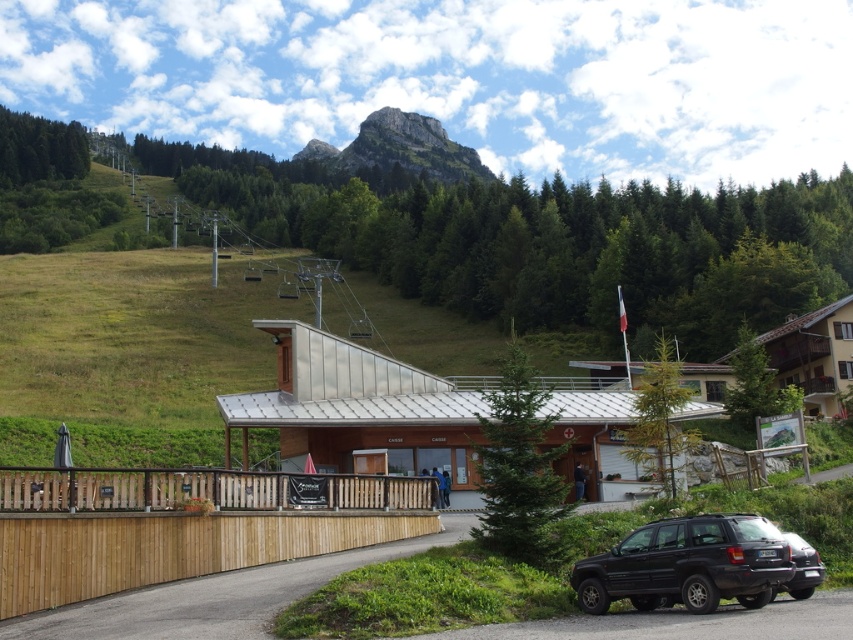
Between wooden fence at lower center and black matte suv at lower right, which one has more height?

wooden fence at lower center

How far apart are wooden fence at lower center and black matte suv at lower right?

wooden fence at lower center and black matte suv at lower right are 15.15 meters apart from each other.

The height and width of the screenshot is (640, 853). What do you see at coordinates (181, 525) in the screenshot?
I see `wooden fence at lower center` at bounding box center [181, 525].

Image resolution: width=853 pixels, height=640 pixels. What are the coordinates of `wooden fence at lower center` in the screenshot? It's located at (181, 525).

Between brown wooden fence at lower center and green rocky mountain at upper center, which one has less height?

brown wooden fence at lower center

Is brown wooden fence at lower center smaller than green rocky mountain at upper center?

Indeed, brown wooden fence at lower center has a smaller size compared to green rocky mountain at upper center.

The height and width of the screenshot is (640, 853). What do you see at coordinates (202, 490) in the screenshot? I see `brown wooden fence at lower center` at bounding box center [202, 490].

Locate an element on the screen. brown wooden fence at lower center is located at coordinates (202, 490).

Looking at this image, is wooden fence at lower center above green rocky mountain at upper center?

No, wooden fence at lower center is not above green rocky mountain at upper center.

The width and height of the screenshot is (853, 640). Describe the element at coordinates (181, 525) in the screenshot. I see `wooden fence at lower center` at that location.

Is point (183, 538) more distant than point (386, 140)?

No.

Locate an element on the screen. wooden fence at lower center is located at coordinates (181, 525).